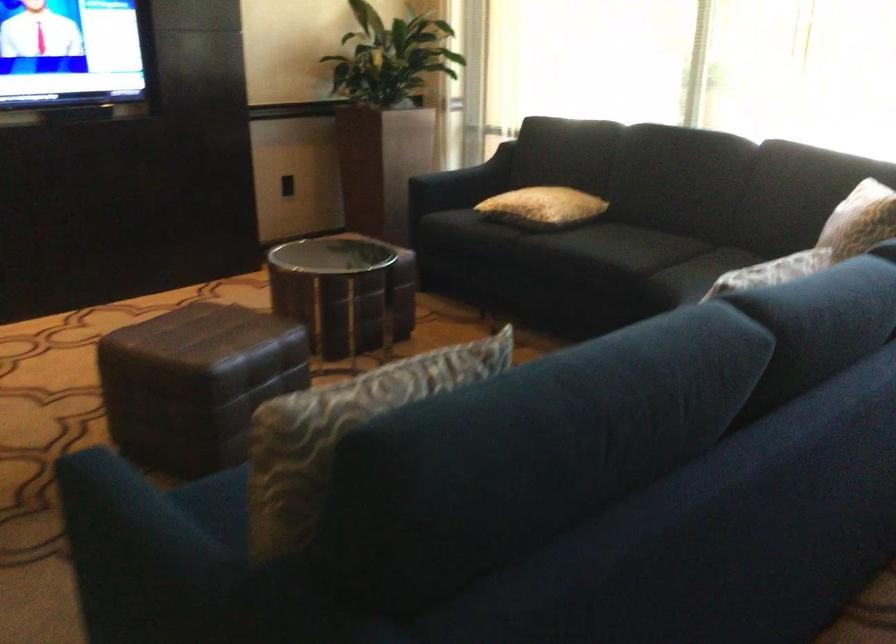
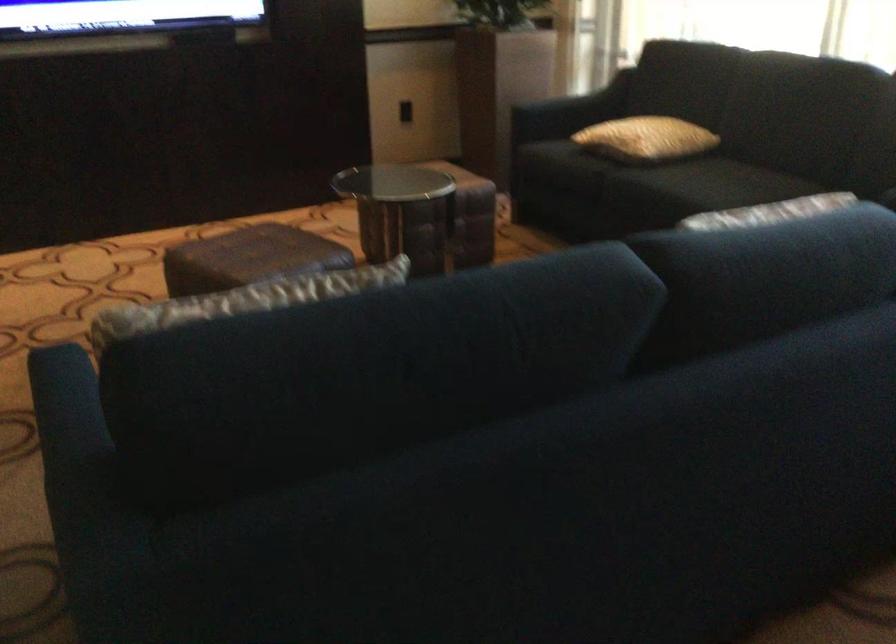
In the second image, find the point that corresponds to the point at 383,366 in the first image.

(252, 298)